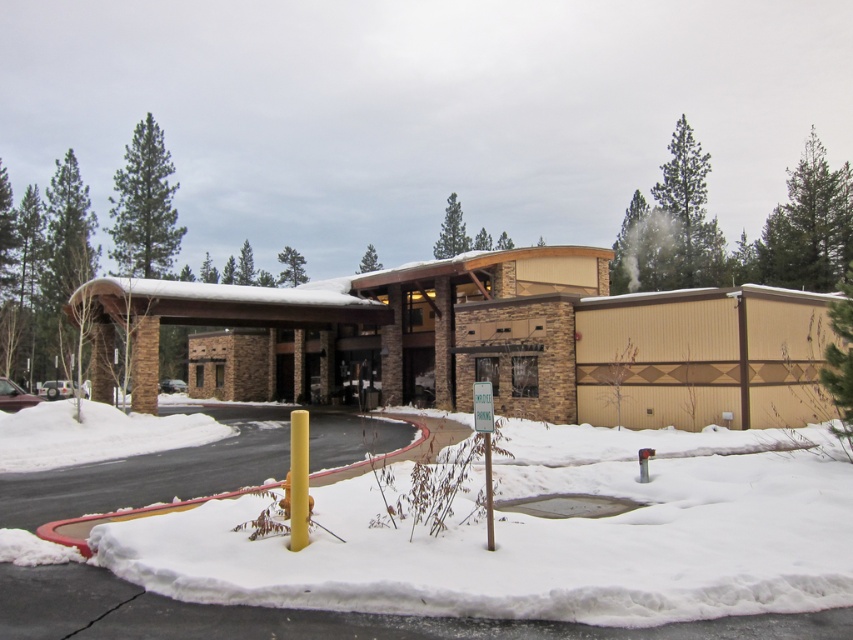
Does white fluffy snow at lower left have a lesser height compared to beige wood hotel at center?

Indeed, white fluffy snow at lower left has a lesser height compared to beige wood hotel at center.

Between point (842, 561) and point (486, 332), which one is positioned in front?

Point (842, 561)

Locate an element on the screen. white fluffy snow at lower left is located at coordinates (538, 540).